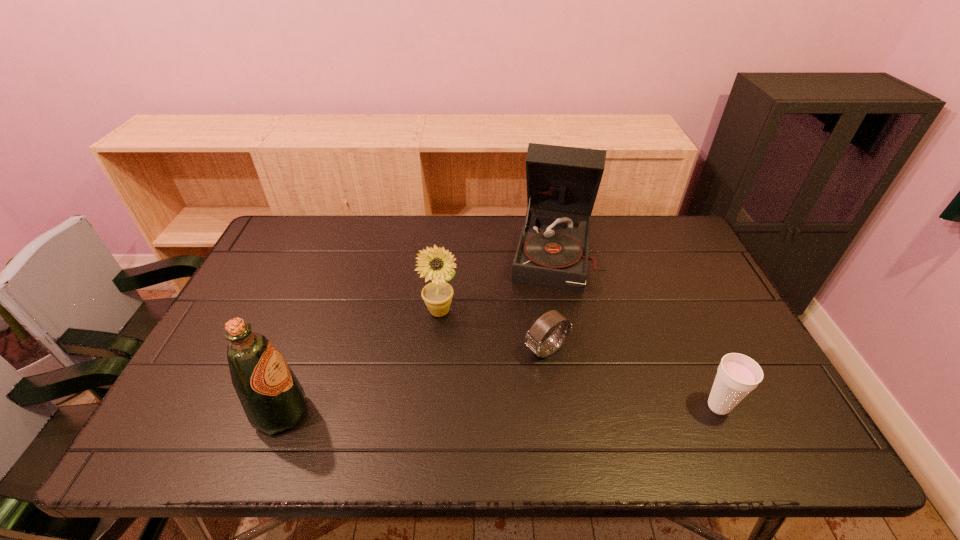
Where is `vacant space situated 0.080m on the front-facing side of the tallest object`? The height and width of the screenshot is (540, 960). vacant space situated 0.080m on the front-facing side of the tallest object is located at coordinates (547, 311).

You are a GUI agent. You are given a task and a screenshot of the screen. Output one action in this format:
    pyautogui.click(x=<x>, y=<y>)
    Task: Click on the object located at the far edge
    
    Given the screenshot: What is the action you would take?
    pyautogui.click(x=562, y=182)

Locate an element on the screen. olive oil that is at the near edge is located at coordinates (273, 399).

In order to click on cup that is at the near edge in this screenshot , I will do `click(737, 375)`.

Where is `object that is positioned at the right edge`? object that is positioned at the right edge is located at coordinates click(737, 375).

Find the location of a particular element. The image size is (960, 540). object positioned at the near right corner is located at coordinates (737, 375).

Locate an element on the screen. free space at the far edge of the desktop is located at coordinates click(x=392, y=225).

This screenshot has height=540, width=960. I want to click on free space at the near edge, so click(x=422, y=386).

The height and width of the screenshot is (540, 960). What are the coordinates of `vacant region at the left edge` in the screenshot? It's located at (272, 326).

Where is `vacant region at the right edge of the desktop`? The height and width of the screenshot is (540, 960). vacant region at the right edge of the desktop is located at coordinates (723, 318).